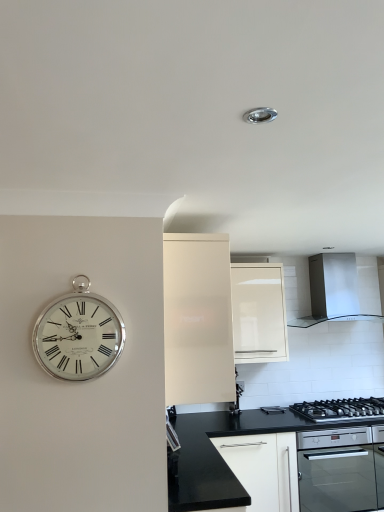
Locate an element on the screen. black granite countertop at lower center is located at coordinates (204, 463).

What is the approximate height of black stainless steel gas stove at lower right?

black stainless steel gas stove at lower right is 2.70 inches tall.

The height and width of the screenshot is (512, 384). What are the coordinates of `black stainless steel gas stove at lower right` in the screenshot? It's located at (341, 409).

What are the coordinates of `white glossy cabinet at upper center, the second cabinetry positioned from the left` in the screenshot? It's located at (259, 313).

What is the approximate height of stainless steel range hood at upper right?

The height of stainless steel range hood at upper right is 24.57 inches.

Locate an element on the screen. black granite countertop at lower center is located at coordinates (x=204, y=463).

Is black glass oven at lower right far away from matte white cabinet at center, the first cabinetry positioned from the left?

Yes, black glass oven at lower right and matte white cabinet at center, the first cabinetry positioned from the left, are located far from each other.

Considering the relative sizes of black glass oven at lower right and matte white cabinet at center, the first cabinetry positioned from the left, in the image provided, is black glass oven at lower right bigger than matte white cabinet at center, the first cabinetry positioned from the left,?

No, black glass oven at lower right is not bigger than matte white cabinet at center, the first cabinetry positioned from the left.

Considering the positions of points (341, 487) and (224, 368), is point (341, 487) farther from camera compared to point (224, 368)?

Yes, point (341, 487) is farther from viewer.

From a real-world perspective, is black glass oven at lower right located higher than matte white cabinet at center, the second cabinetry positioned from the right?

No, from a real-world perspective, black glass oven at lower right is not over matte white cabinet at center, the second cabinetry positioned from the right

Considering the sizes of objects black glass oven at lower right and stainless steel range hood at upper right in the image provided, who is wider, black glass oven at lower right or stainless steel range hood at upper right?

black glass oven at lower right is wider.

At what (x,y) coordinates should I click in order to perform the action: click on oven on the left of stainless steel range hood at upper right. Please return your answer as a coordinate pair (x, y). Looking at the image, I should click on (336, 470).

In the scene shown: Can you tell me how much black glass oven at lower right and stainless steel range hood at upper right differ in facing direction?

The angular difference between black glass oven at lower right and stainless steel range hood at upper right is 0.303 degrees.

From the picture: From a real-world perspective, which object stands above the other?

From a 3D spatial view, stainless steel range hood at upper right is above.

What's the angular difference between black stainless steel gas stove at lower right and black granite countertop at lower center's facing directions?

They differ by 89.5 degrees in their facing directions.

Between point (367, 406) and point (200, 420), which one is positioned in front?

The point (367, 406) is more forward.

Image resolution: width=384 pixels, height=512 pixels. I want to click on counter top lying in front of the black stainless steel gas stove at lower right, so [204, 463].

Does black stainless steel gas stove at lower right turn towards black granite countertop at lower center?

No, black stainless steel gas stove at lower right is not turned towards black granite countertop at lower center.

Considering the relative positions of white glossy cabinet at upper center, the second cabinetry positioned from the left, and matte white cabinet at center, the first cabinetry positioned from the left, in the image provided, is white glossy cabinet at upper center, the second cabinetry positioned from the left, to the right of matte white cabinet at center, the first cabinetry positioned from the left, from the viewer's perspective?

Correct, you'll find white glossy cabinet at upper center, the second cabinetry positioned from the left, to the right of matte white cabinet at center, the first cabinetry positioned from the left.

From the picture: Is white glossy cabinet at upper center, placed as the 1th cabinetry when sorted from right to left, positioned in front of matte white cabinet at center, the second cabinetry positioned from the right?

No.

Considering the sizes of objects white glossy cabinet at upper center, the second cabinetry positioned from the left, and matte white cabinet at center, the first cabinetry positioned from the left, in the image provided, who is taller, white glossy cabinet at upper center, the second cabinetry positioned from the left, or matte white cabinet at center, the first cabinetry positioned from the left,?

Standing taller between the two is matte white cabinet at center, the first cabinetry positioned from the left.

Are white glossy cabinet at upper center, placed as the 1th cabinetry when sorted from right to left, and matte white cabinet at center, the second cabinetry positioned from the right, located far from each other?

That's right, there is a large distance between white glossy cabinet at upper center, placed as the 1th cabinetry when sorted from right to left, and matte white cabinet at center, the second cabinetry positioned from the right.

How different are the orientations of stainless steel range hood at upper right and black stainless steel gas stove at lower right in degrees?

0.269 degrees separate the facing orientations of stainless steel range hood at upper right and black stainless steel gas stove at lower right.

Can you confirm if stainless steel range hood at upper right is wider than black stainless steel gas stove at lower right?

No, stainless steel range hood at upper right is not wider than black stainless steel gas stove at lower right.

Is stainless steel range hood at upper right situated inside black stainless steel gas stove at lower right or outside?

The correct answer is: outside.

Considering the relative sizes of white glossy cabinet at upper center, the second cabinetry positioned from the left, and silver metallic clock at left in the image provided, is white glossy cabinet at upper center, the second cabinetry positioned from the left, thinner than silver metallic clock at left?

No, white glossy cabinet at upper center, the second cabinetry positioned from the left, is not thinner than silver metallic clock at left.

Based on the photo, how different are the orientations of white glossy cabinet at upper center, placed as the 1th cabinetry when sorted from right to left, and silver metallic clock at left in degrees?

white glossy cabinet at upper center, placed as the 1th cabinetry when sorted from right to left, and silver metallic clock at left are facing 0.904 degrees away from each other.

Based on the photo, considering the relative sizes of white glossy cabinet at upper center, the second cabinetry positioned from the left, and silver metallic clock at left in the image provided, is white glossy cabinet at upper center, the second cabinetry positioned from the left, bigger than silver metallic clock at left?

Correct, white glossy cabinet at upper center, the second cabinetry positioned from the left, is larger in size than silver metallic clock at left.

Is white glossy cabinet at upper center, placed as the 1th cabinetry when sorted from right to left, located outside silver metallic clock at left?

That's correct, white glossy cabinet at upper center, placed as the 1th cabinetry when sorted from right to left, is outside of silver metallic clock at left.

Which point is more forward, (91, 361) or (210, 495)?

The point (91, 361) is in front.

Is silver metallic clock at left not close to black granite countertop at lower center?

silver metallic clock at left is near black granite countertop at lower center, not far away.

Considering the sizes of silver metallic clock at left and black granite countertop at lower center in the image, is silver metallic clock at left bigger or smaller than black granite countertop at lower center?

In the image, silver metallic clock at left appears to be smaller than black granite countertop at lower center.

From the image's perspective, which one is positioned lower, silver metallic clock at left or black granite countertop at lower center?

black granite countertop at lower center is shown below in the image.

Find the location of a particular element. This screenshot has height=512, width=384. oven lying behind the matte white cabinet at center, the first cabinetry positioned from the left is located at coordinates (336, 470).

Where is `oven located below the stainless steel range hood at upper right (from the image's perspective)`? oven located below the stainless steel range hood at upper right (from the image's perspective) is located at coordinates (336, 470).

Considering their positions, is black glass oven at lower right positioned closer to stainless steel range hood at upper right than matte white cabinet at center, the second cabinetry positioned from the right?

black glass oven at lower right is positioned closer to the anchor stainless steel range hood at upper right.

Considering their positions, is matte white cabinet at center, the second cabinetry positioned from the right, positioned further to stainless steel range hood at upper right than white glossy cabinet at upper center, placed as the 1th cabinetry when sorted from right to left?

The object further to stainless steel range hood at upper right is matte white cabinet at center, the second cabinetry positioned from the right.

Looking at the image, which one is located further to matte white cabinet at center, the first cabinetry positioned from the left, black stainless steel gas stove at lower right or stainless steel range hood at upper right?

The object further to matte white cabinet at center, the first cabinetry positioned from the left, is stainless steel range hood at upper right.

Which object lies nearer to the anchor point black glass oven at lower right, stainless steel range hood at upper right or black granite countertop at lower center?

The object closer to black glass oven at lower right is black granite countertop at lower center.

When comparing their distances from silver metallic clock at left, does black stainless steel gas stove at lower right or black glass oven at lower right seem closer?

Based on the image, black glass oven at lower right appears to be nearer to silver metallic clock at left.

Which object lies further to the anchor point white glossy cabinet at upper center, placed as the 1th cabinetry when sorted from right to left, black stainless steel gas stove at lower right or matte white cabinet at center, the first cabinetry positioned from the left?

matte white cabinet at center, the first cabinetry positioned from the left.

Estimate the real-world distances between objects in this image. Which object is further from matte white cabinet at center, the first cabinetry positioned from the left, white glossy cabinet at upper center, the second cabinetry positioned from the left, or black stainless steel gas stove at lower right?

Based on the image, black stainless steel gas stove at lower right appears to be further to matte white cabinet at center, the first cabinetry positioned from the left.

Estimate the real-world distances between objects in this image. Which object is closer to black glass oven at lower right, white glossy cabinet at upper center, placed as the 1th cabinetry when sorted from right to left, or black stainless steel gas stove at lower right?

black stainless steel gas stove at lower right is positioned closer to the anchor black glass oven at lower right.

Identify the location of gas stove between black granite countertop at lower center and white glossy cabinet at upper center, the second cabinetry positioned from the left, in the front-back direction. tap(341, 409).

This screenshot has height=512, width=384. I want to click on oven between black granite countertop at lower center and white glossy cabinet at upper center, the second cabinetry positioned from the left, in the front-back direction, so click(336, 470).

Where is `home appliance between silver metallic clock at left and black stainless steel gas stove at lower right`? The height and width of the screenshot is (512, 384). home appliance between silver metallic clock at left and black stainless steel gas stove at lower right is located at coordinates (333, 290).

I want to click on gas stove between black granite countertop at lower center and stainless steel range hood at upper right in the front-back direction, so click(341, 409).